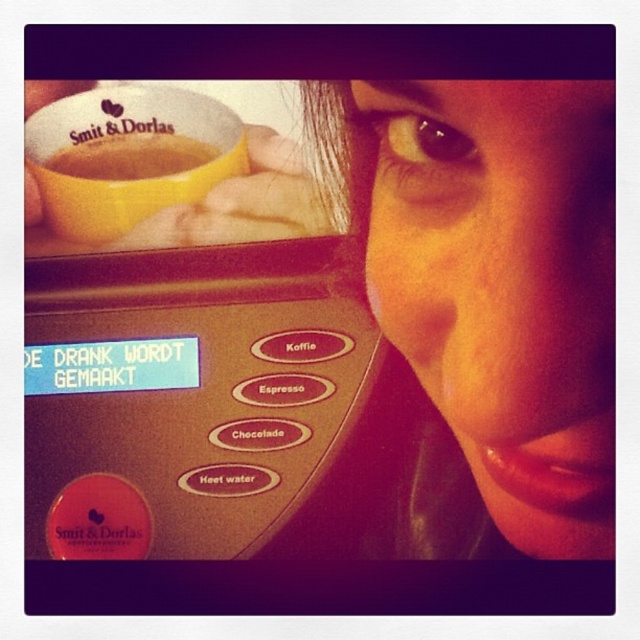
You are standing in front of a coffee machine that has a digital display showing the message. You see the yellow matte cup at upper left. Can you determine if the cup is positioned to the left or right of the coffee machine?

The yellow matte cup at upper left is located at point (122, 150), which places it to the left of the coffee machine.

You are a barista working at a coffee shop. You need to place a golden plastic cup at upper left on the counter next to the coffee machine. However, there is a smooth skin face at upper right in the way. Can you move the cup without disturbing the face?

The smooth skin face at upper right is much taller than the golden plastic cup at upper left, so you can carefully move the golden plastic cup at upper left under or around the face without disturbing it.

You are a photographer standing 10 inches away from the smooth skin face at upper right. Can you take a clear photo of the face without moving closer?

The smooth skin face at upper right and viewer are 8.60 inches apart from each other. Since you are standing 10 inches away, you are farther than the distance between the face and the viewer. Therefore, you might not be able to take a clear photo without moving closer.